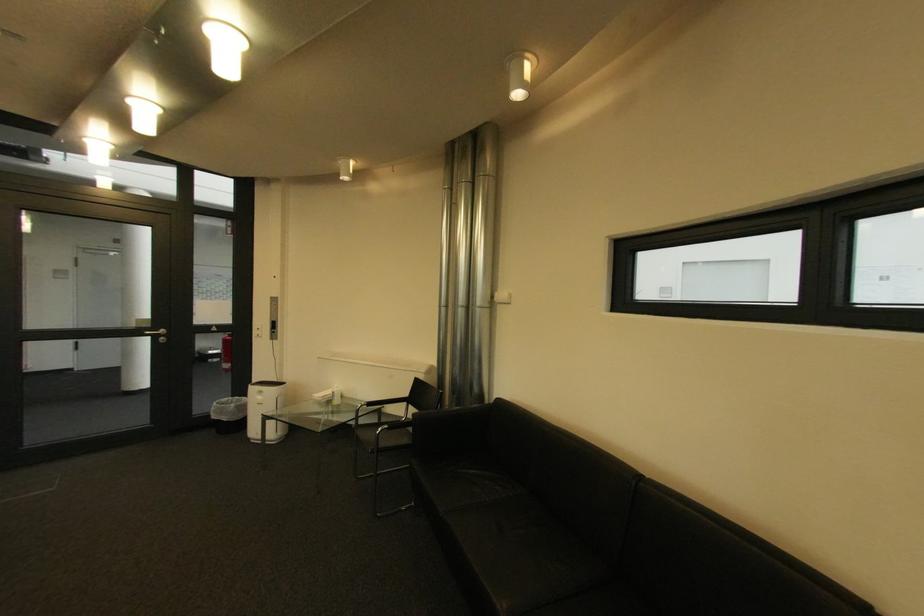
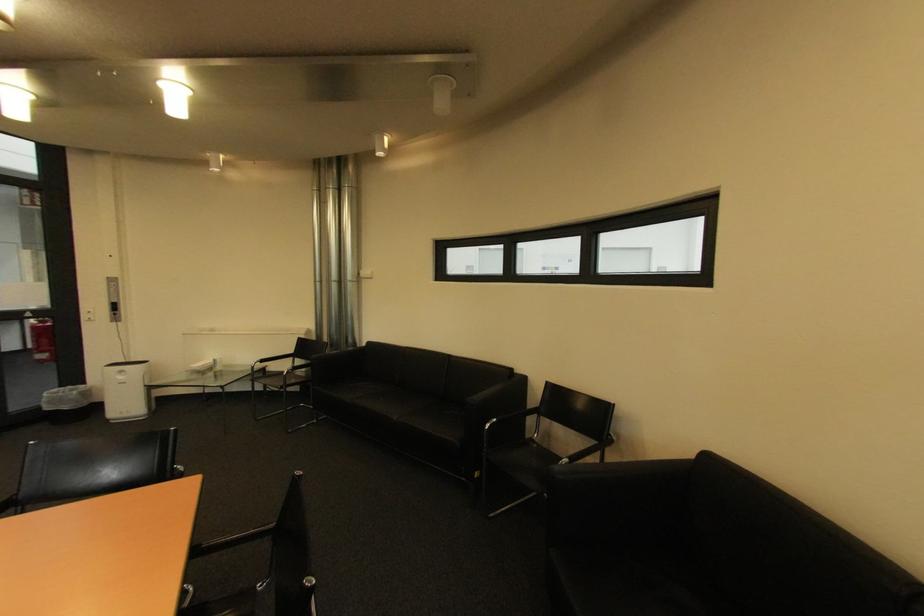
What movement of the cameraman would produce the second image?

The cameraman walked toward left, backward.